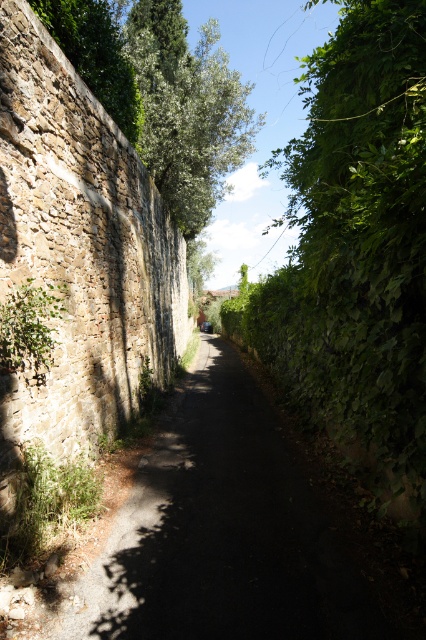
You are a gardener who needs to trim the green leafy hedge at right. Since you can only work from the dark asphalt path at center, will you be able to reach the hedge easily?

The green leafy hedge at right is behind the dark asphalt path at center, so it might be difficult to reach from the path. You may need to find another access point or use long tools to trim it effectively.

You are a gardener who needs to water the green leafy hedge at right using a hose that can extend up to 20 feet. You are currently standing on the dark asphalt path at center. Can you reach the hedge without moving from your current position?

The dark asphalt path at center is 20.57 feet from the green leafy hedge at right. Since the hose can only extend up to 20 feet, you cannot reach the hedge without moving closer.

You are standing at the center of the pathway and want to take a photo of the green leafy hedge at right. Which direction should you turn to face the hedge?

The green leafy hedge at right is located to your right side, so you should turn to your right to face it.